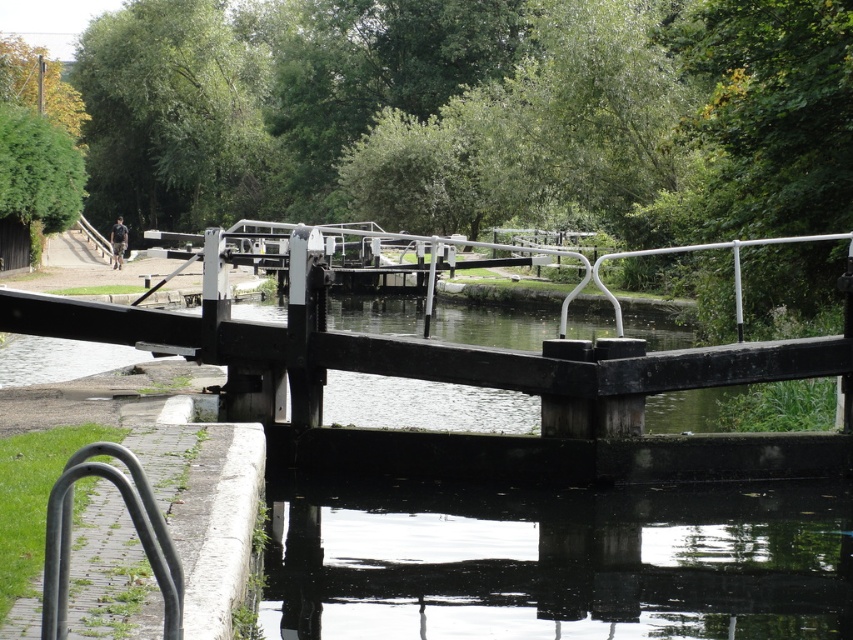
Is smooth white rail at center thinner than black metal bike rack at lower left?

In fact, smooth white rail at center might be wider than black metal bike rack at lower left.

Who is lower down, smooth white rail at center or black metal bike rack at lower left?

Positioned lower is black metal bike rack at lower left.

Is point (705, 349) farther from camera compared to point (47, 566)?

Yes, it is.

The width and height of the screenshot is (853, 640). What are the coordinates of `smooth white rail at center` in the screenshot? It's located at (421, 349).

Does transparent water at center have a smaller size compared to black metal bike rack at lower left?

Incorrect, transparent water at center is not smaller in size than black metal bike rack at lower left.

Measure the distance between transparent water at center and camera.

7.94 meters

Image resolution: width=853 pixels, height=640 pixels. What do you see at coordinates (556, 561) in the screenshot?
I see `transparent water at center` at bounding box center [556, 561].

The image size is (853, 640). What are the coordinates of `transparent water at center` in the screenshot? It's located at (556, 561).

Is transparent water at center thinner than smooth white rail at center?

Correct, transparent water at center's width is less than smooth white rail at center's.

Locate an element on the screen. This screenshot has width=853, height=640. transparent water at center is located at coordinates (556, 561).

Image resolution: width=853 pixels, height=640 pixels. What are the coordinates of `transparent water at center` in the screenshot? It's located at (556, 561).